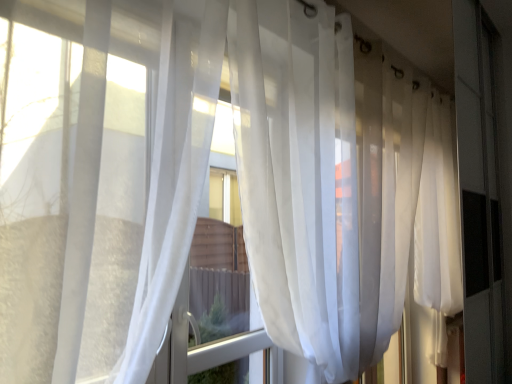
Question: Are translucent white curtain at left, the second curtain from the right, and translucent white curtain at center, arranged as the 2th curtain when viewed from the left, making contact?

Choices:
 (A) yes
 (B) no

Answer: (B)

Question: Is translucent white curtain at left, the 1th curtain in the left-to-right sequence, closer to camera compared to translucent white curtain at center, positioned as the first curtain in right-to-left order?

Choices:
 (A) no
 (B) yes

Answer: (B)

Question: Is translucent white curtain at left, the second curtain from the right, shorter than translucent white curtain at center, positioned as the first curtain in right-to-left order?

Choices:
 (A) no
 (B) yes

Answer: (B)

Question: Does translucent white curtain at left, the 1th curtain in the left-to-right sequence, have a greater height compared to translucent white curtain at center, arranged as the 2th curtain when viewed from the left?

Choices:
 (A) no
 (B) yes

Answer: (A)

Question: From a real-world perspective, is translucent white curtain at left, the 1th curtain in the left-to-right sequence, below translucent white curtain at center, positioned as the first curtain in right-to-left order?

Choices:
 (A) no
 (B) yes

Answer: (A)

Question: Can you confirm if translucent white curtain at left, the second curtain from the right, is smaller than translucent white curtain at center, positioned as the first curtain in right-to-left order?

Choices:
 (A) yes
 (B) no

Answer: (A)

Question: Is translucent white curtain at center, arranged as the 2th curtain when viewed from the left, positioned far away from translucent white curtain at left, the 1th curtain in the left-to-right sequence?

Choices:
 (A) no
 (B) yes

Answer: (A)

Question: Is translucent white curtain at center, positioned as the first curtain in right-to-left order, beside translucent white curtain at left, the second curtain from the right?

Choices:
 (A) yes
 (B) no

Answer: (B)

Question: Is the position of translucent white curtain at center, positioned as the first curtain in right-to-left order, more distant than that of translucent white curtain at left, the second curtain from the right?

Choices:
 (A) yes
 (B) no

Answer: (A)

Question: Can you confirm if translucent white curtain at center, arranged as the 2th curtain when viewed from the left, is wider than translucent white curtain at left, the second curtain from the right?

Choices:
 (A) yes
 (B) no

Answer: (B)

Question: From the image's perspective, is translucent white curtain at center, positioned as the first curtain in right-to-left order, under translucent white curtain at left, the second curtain from the right?

Choices:
 (A) no
 (B) yes

Answer: (B)

Question: From a real-world perspective, is translucent white curtain at center, positioned as the first curtain in right-to-left order, positioned over translucent white curtain at left, the second curtain from the right, based on gravity?

Choices:
 (A) yes
 (B) no

Answer: (B)

Question: In terms of height, does translucent white curtain at center, positioned as the first curtain in right-to-left order, look taller or shorter compared to translucent white curtain at left, the 1th curtain in the left-to-right sequence?

Choices:
 (A) tall
 (B) short

Answer: (A)